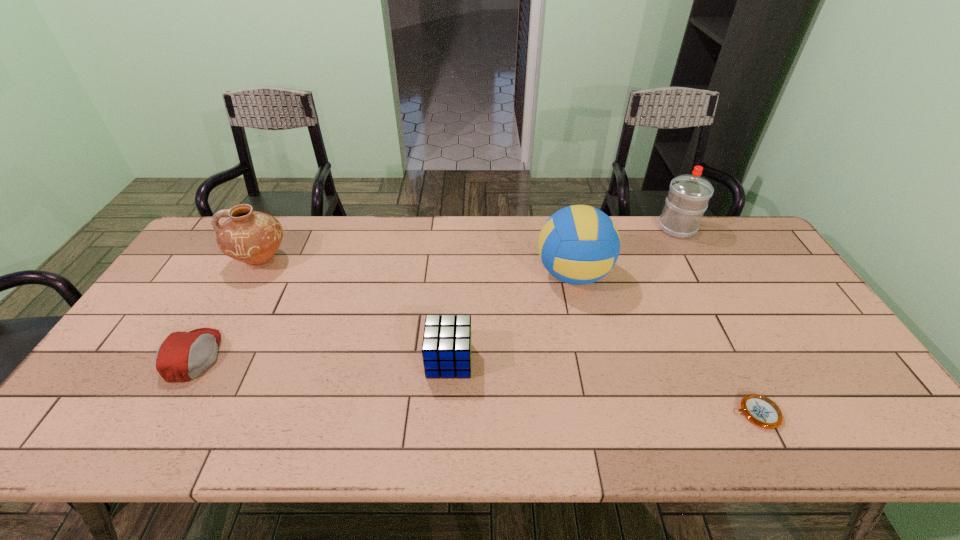
Identify the location of vacant point located between the third tallest object and the volleyball. (417, 268).

This screenshot has height=540, width=960. I want to click on blank region between the farthest object and the shortest object, so click(717, 320).

Find the location of a particular element. free spot between the third shortest object and the third tallest object is located at coordinates [355, 310].

You are a GUI agent. You are given a task and a screenshot of the screen. Output one action in this format:
    pyautogui.click(x=<x>, y=<y>)
    Task: Click on the vacant space that's between the volleyball and the nearest object
    The image size is (960, 540).
    Given the screenshot: What is the action you would take?
    click(x=664, y=344)

Locate which object ranks fifth in proximity to the nearest object. Please provide its 2D coordinates. Your answer should be formatted as a tuple, i.e. [(x, y)], where the tuple contains the x and y coordinates of a point satisfying the conditions above.

[(252, 237)]

Identify which object is located as the second nearest to the water bottle. Please provide its 2D coordinates. Your answer should be formatted as a tuple, i.e. [(x, y)], where the tuple contains the x and y coordinates of a point satisfying the conditions above.

[(760, 410)]

Find the location of a particular element. The image size is (960, 540). free space that satisfies the following two spatial constraints: 1. on the side of the third tallest object with the handle; 2. on the handle side of the farthest object is located at coordinates (279, 228).

Find the location of a particular element. The width and height of the screenshot is (960, 540). free space in the image that satisfies the following two spatial constraints: 1. on the side of the pottery with the handle; 2. on the handle side of the farthest object is located at coordinates (279, 228).